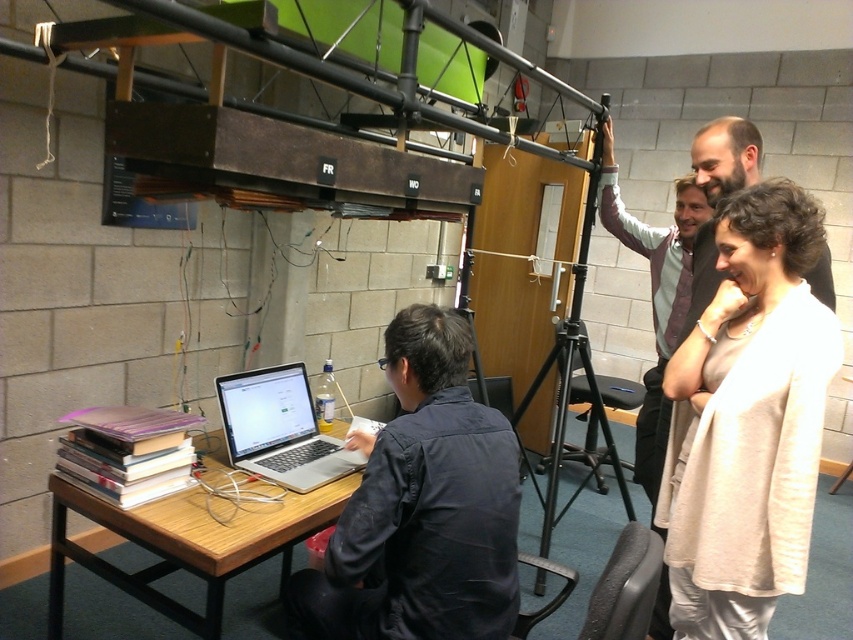
Question: Is light beige sweater at right positioned behind black metal tripod at center?

Choices:
 (A) no
 (B) yes

Answer: (A)

Question: Which point is closer to the camera taking this photo?

Choices:
 (A) (254, 456)
 (B) (675, 515)

Answer: (B)

Question: Does wooden table at lower left appear under black metal tripod at center?

Choices:
 (A) no
 (B) yes

Answer: (B)

Question: Among these objects, which one is farthest from the camera?

Choices:
 (A) light beige sweater at right
 (B) black metal tripod at center

Answer: (B)

Question: Which point is closer to the camera?

Choices:
 (A) (722, 442)
 (B) (474, 563)

Answer: (B)

Question: Can you confirm if light beige sweater at right is wider than sleek silver laptop at center?

Choices:
 (A) no
 (B) yes

Answer: (B)